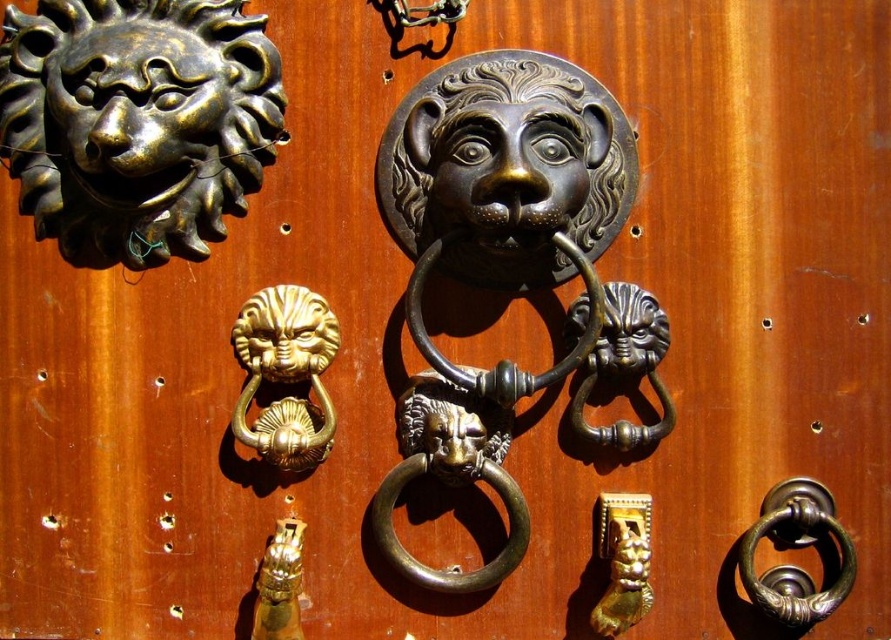
Can you confirm if brass/bronze lion head at center is shorter than polished brass lion head at center?

Indeed, brass/bronze lion head at center has a lesser height compared to polished brass lion head at center.

Is point (616, 333) positioned before point (407, 288)?

Yes, it is in front of point (407, 288).

Where is `brass/bronze lion head at center`? brass/bronze lion head at center is located at coordinates (625, 364).

Which of these two, brass lion head at upper left or gold polished lion head at lower right, stands taller?

brass lion head at upper left is taller.

Can you confirm if brass lion head at upper left is wider than gold polished lion head at lower right?

Indeed, brass lion head at upper left has a greater width compared to gold polished lion head at lower right.

Is point (39, 205) positioned before point (642, 529)?

No, it is behind (642, 529).

Locate an element on the screen. brass lion head at upper left is located at coordinates (137, 116).

Does brass ring handle at center have a greater width compared to gold polished lion head at lower right?

Correct, the width of brass ring handle at center exceeds that of gold polished lion head at lower right.

Which is below, brass ring handle at center or gold polished lion head at lower right?

gold polished lion head at lower right is lower down.

Image resolution: width=891 pixels, height=640 pixels. I want to click on brass ring handle at center, so click(x=450, y=476).